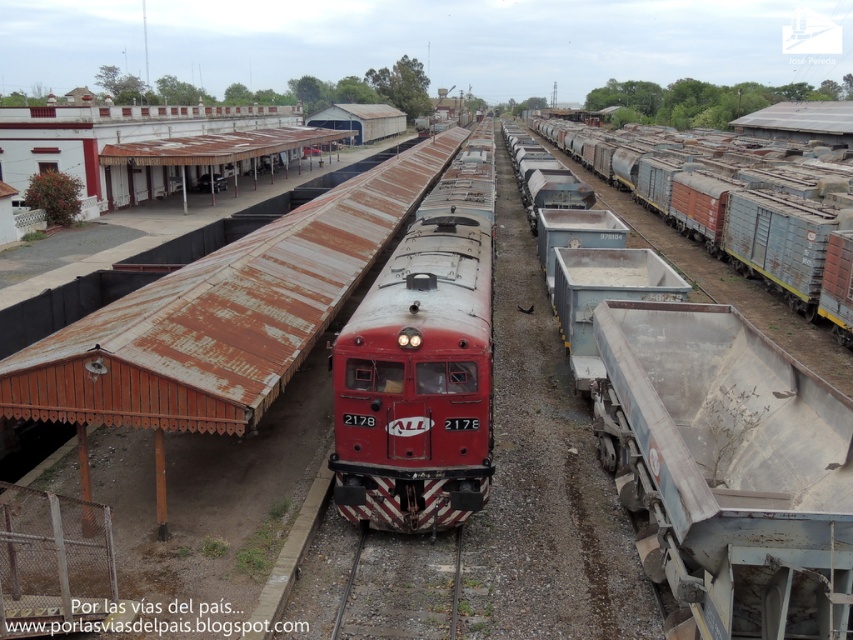
Is red matte locomotive at center above gray gravel train track at center?

Yes.

Is the position of red matte locomotive at center less distant than that of gray gravel train track at center?

No.

Which is behind, point (364, 480) or point (335, 632)?

Positioned behind is point (364, 480).

Image resolution: width=853 pixels, height=640 pixels. Identify the location of red matte locomotive at center. coord(422,364).

In the scene shown: Does red matte locomotive at center have a larger size compared to rusty metal freight car at center?

No.

Does red matte locomotive at center have a greater height compared to rusty metal freight car at center?

No, red matte locomotive at center is not taller than rusty metal freight car at center.

Which is behind, point (459, 246) or point (705, 179)?

The point (705, 179) is more distant.

Where is `red matte locomotive at center`? red matte locomotive at center is located at coordinates (422, 364).

Is point (723, 192) more distant than point (345, 584)?

Yes, it is behind point (345, 584).

Consider the image. Is rusty metal freight car at center to the left of gray gravel train track at center from the viewer's perspective?

In fact, rusty metal freight car at center is to the right of gray gravel train track at center.

Find the location of a particular element. The height and width of the screenshot is (640, 853). rusty metal freight car at center is located at coordinates (717, 204).

Image resolution: width=853 pixels, height=640 pixels. Find the location of `rusty metal freight car at center`. rusty metal freight car at center is located at coordinates (717, 204).